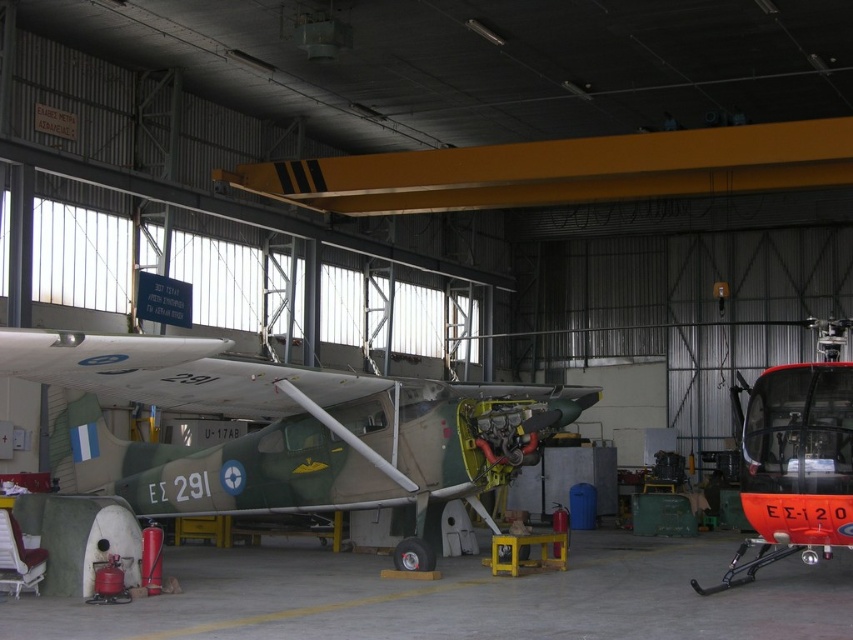
Does point (398, 392) lie in front of point (801, 406)?

That is False.

Is camouflage paint airplane at center positioned at the back of orange glossy helicopter at right?

Yes, camouflage paint airplane at center is further from the viewer.

Is point (65, 372) less distant than point (772, 445)?

Yes, it is.

Where is `camouflage paint airplane at center`? camouflage paint airplane at center is located at coordinates (296, 429).